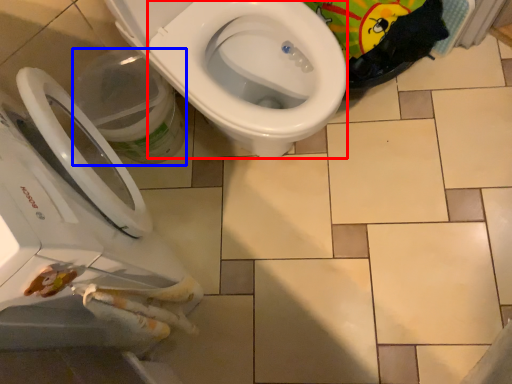
Question: Which object appears farthest to the camera in this image, bidet (highlighted by a red box) or potty (highlighted by a blue box)?

Choices:
 (A) bidet
 (B) potty

Answer: (B)